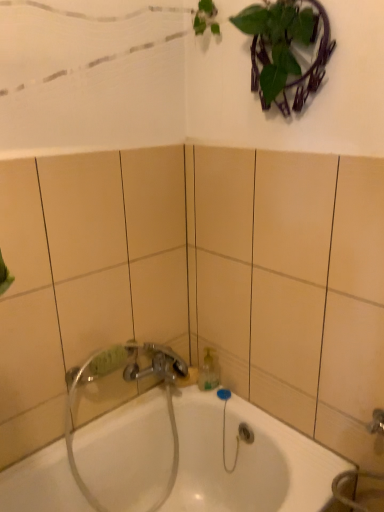
Question: Is clear plastic hose at lower center wider than white glossy bathtub at center?

Choices:
 (A) no
 (B) yes

Answer: (A)

Question: Is clear plastic hose at lower center completely or partially outside of white glossy bathtub at center?

Choices:
 (A) no
 (B) yes

Answer: (A)

Question: Could you tell me if clear plastic hose at lower center is facing white glossy bathtub at center?

Choices:
 (A) yes
 (B) no

Answer: (A)

Question: Considering the relative sizes of clear plastic hose at lower center and white glossy bathtub at center in the image provided, is clear plastic hose at lower center smaller than white glossy bathtub at center?

Choices:
 (A) yes
 (B) no

Answer: (A)

Question: From the image's perspective, does clear plastic hose at lower center appear lower than white glossy bathtub at center?

Choices:
 (A) yes
 (B) no

Answer: (B)

Question: Does clear plastic hose at lower center have a greater height compared to white glossy bathtub at center?

Choices:
 (A) no
 (B) yes

Answer: (B)

Question: From the image's perspective, is white glossy bathtub at center under clear plastic hose at lower center?

Choices:
 (A) no
 (B) yes

Answer: (B)

Question: Is white glossy bathtub at center bigger than clear plastic hose at lower center?

Choices:
 (A) no
 (B) yes

Answer: (B)

Question: Can you confirm if white glossy bathtub at center is taller than clear plastic hose at lower center?

Choices:
 (A) yes
 (B) no

Answer: (B)

Question: Is white glossy bathtub at center smaller than clear plastic hose at lower center?

Choices:
 (A) no
 (B) yes

Answer: (A)

Question: Does white glossy bathtub at center have a lesser height compared to clear plastic hose at lower center?

Choices:
 (A) yes
 (B) no

Answer: (A)

Question: From a real-world perspective, does white glossy bathtub at center stand above clear plastic hose at lower center?

Choices:
 (A) yes
 (B) no

Answer: (B)

Question: From their relative heights in the image, would you say clear plastic hose at lower center is taller or shorter than white glossy bathtub at center?

Choices:
 (A) tall
 (B) short

Answer: (A)